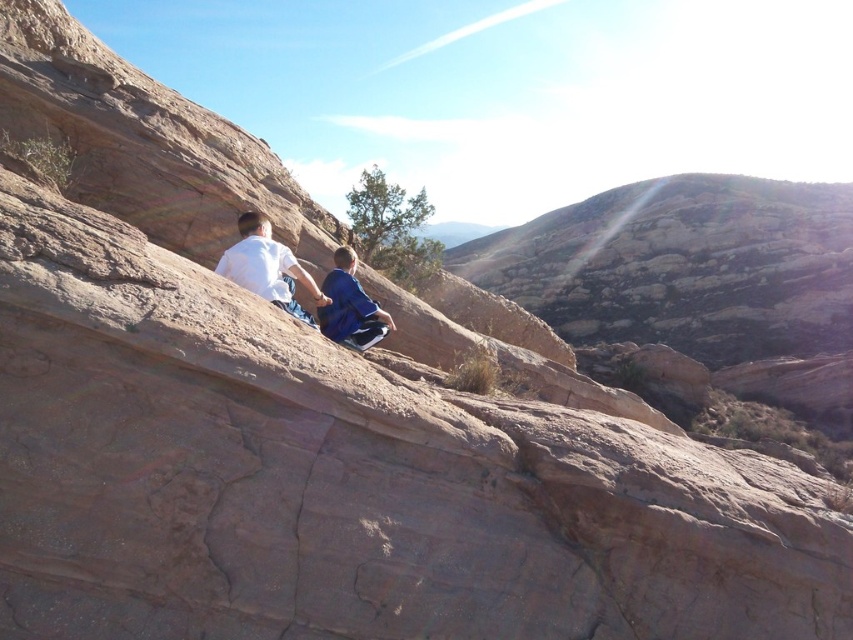
Can you confirm if white matte shirt at center is smaller than blue fabric pants at center?

No.

Is point (248, 228) more distant than point (372, 324)?

No, (248, 228) is closer to viewer.

The height and width of the screenshot is (640, 853). What do you see at coordinates (267, 268) in the screenshot?
I see `white matte shirt at center` at bounding box center [267, 268].

Image resolution: width=853 pixels, height=640 pixels. I want to click on white matte shirt at center, so click(267, 268).